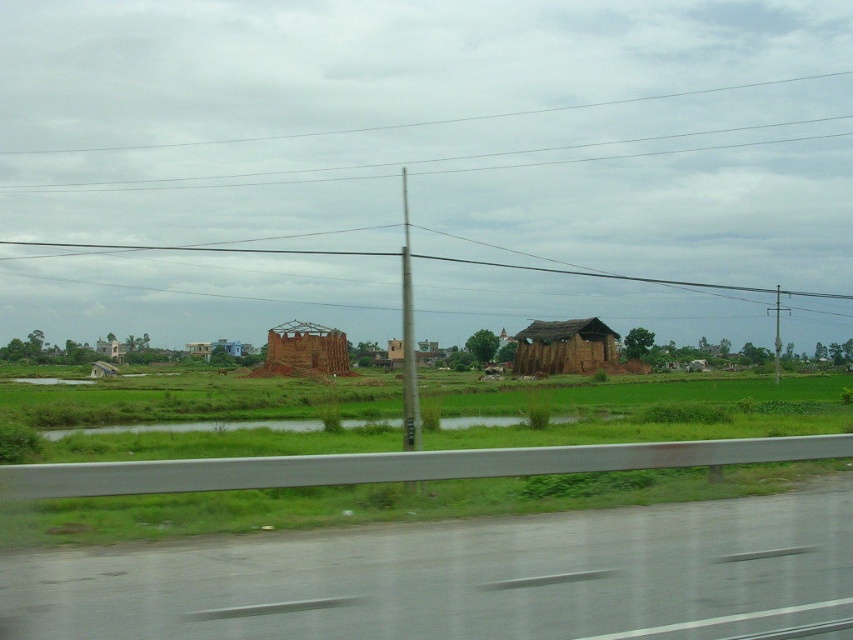
From the picture: You are driving on the gray asphalt highway at lower center and want to make a U turn. Considering the width of the highway compared to the brown brick hut at center, is there enough space to complete the U turn without crossing the opposite lane?

The gray asphalt highway at lower center is narrower than the brown brick hut at center, so there might not be enough space to safely perform a U turn without crossing into the opposite lane. It is advisable to look for a wider section of the road or an alternative route.